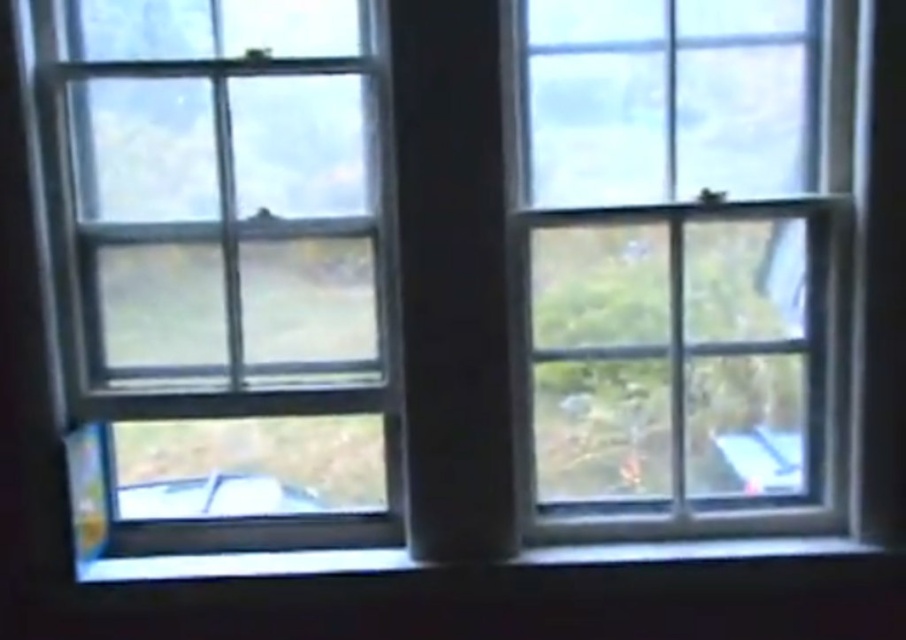
Question: Does clear glass window at left appear under clear glass window at center?

Choices:
 (A) no
 (B) yes

Answer: (B)

Question: Is clear glass window at left positioned behind clear glass window at center?

Choices:
 (A) no
 (B) yes

Answer: (A)

Question: Can you confirm if clear glass window at left is wider than clear glass window at center?

Choices:
 (A) no
 (B) yes

Answer: (B)

Question: Which of the following is the closest to the observer?

Choices:
 (A) (65, 330)
 (B) (816, 376)

Answer: (A)

Question: Among these points, which one is farthest from the camera?

Choices:
 (A) (248, 308)
 (B) (776, 332)

Answer: (B)